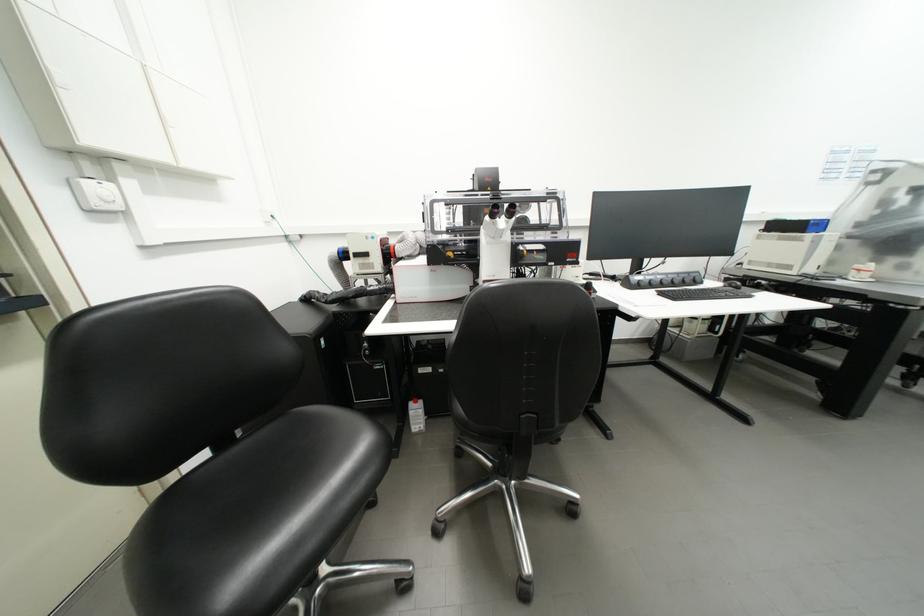
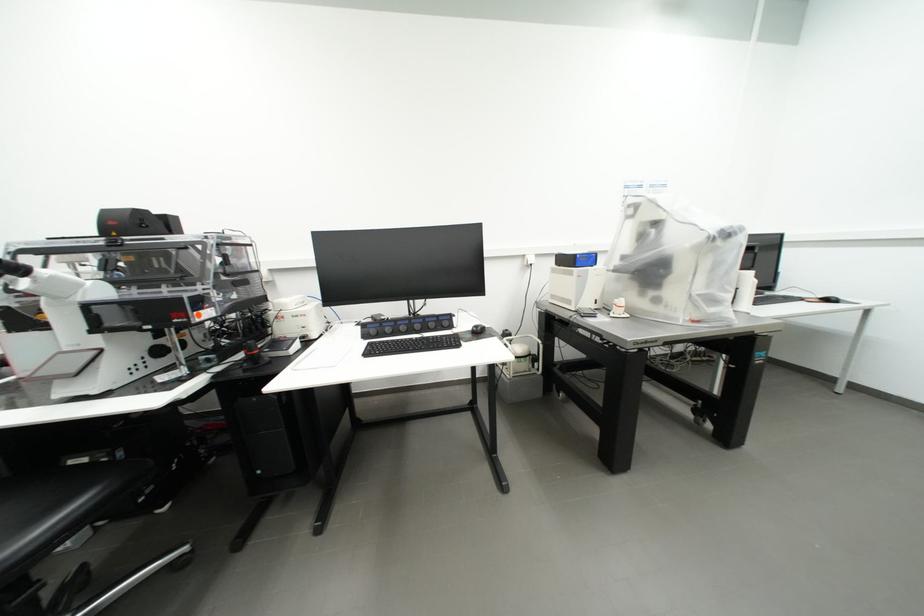
Question: What movement of the cameraman would produce the second image?

Choices:
 (A) Left
 (B) Right
 (C) Forward
 (D) Backward

Answer: (B)